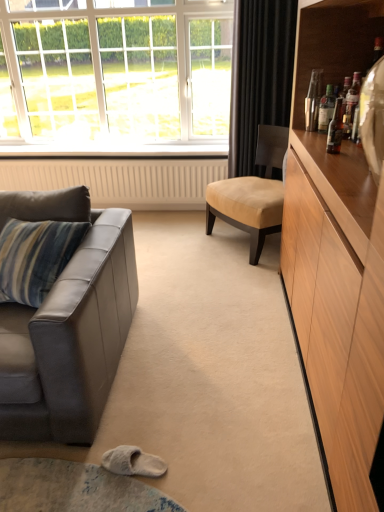
In order to face white glass window at upper left, should I rotate leftwards or rightwards?

Rotate left and turn 9.786 degrees.

I want to click on beige textured radiator at lower center, so click(120, 179).

Find the location of a particular element. The width and height of the screenshot is (384, 512). translucent glass bottle at upper right, acting as the 2th bottle starting from the front is located at coordinates (326, 109).

Describe the element at coordinates (67, 325) in the screenshot. I see `leather couch at left` at that location.

Describe the element at coordinates (259, 75) in the screenshot. I see `black velvet curtain at upper right` at that location.

Locate an element on the screen. The height and width of the screenshot is (512, 384). white glass window at upper left is located at coordinates (115, 73).

Between point (242, 32) and point (207, 226), which one is positioned in front?

Positioned in front is point (242, 32).

From a real-world perspective, is black velvet curtain at upper right positioned above or below beige leather chair at center?

black velvet curtain at upper right is situated higher than beige leather chair at center in the real world.

Considering the sizes of objects black velvet curtain at upper right and beige leather chair at center in the image provided, who is bigger, black velvet curtain at upper right or beige leather chair at center?

beige leather chair at center.

Considering the relative sizes of black velvet curtain at upper right and beige leather chair at center in the image provided, is black velvet curtain at upper right taller than beige leather chair at center?

Yes, black velvet curtain at upper right is taller than beige leather chair at center.

From a real-world perspective, which is physically above, beige leather chair at center or translucent glass bottle at upper right, arranged as the third bottle when viewed from the back?

From a 3D spatial view, translucent glass bottle at upper right, arranged as the third bottle when viewed from the back, is above.

Does beige leather chair at center have a lesser height compared to translucent glass bottle at upper right, arranged as the third bottle when viewed from the back?

Incorrect, the height of beige leather chair at center does not fall short of that of translucent glass bottle at upper right, arranged as the third bottle when viewed from the back.

Which is in front, beige leather chair at center or translucent glass bottle at upper right, marked as the first bottle in a front-to-back arrangement?

translucent glass bottle at upper right, marked as the first bottle in a front-to-back arrangement.

Between point (331, 108) and point (121, 323), which one is positioned behind?

The point (331, 108) is behind.

Is translucent glass bottle at upper right, acting as the 2th bottle starting from the front, located outside leather couch at left?

translucent glass bottle at upper right, acting as the 2th bottle starting from the front, is positioned outside leather couch at left.

Is translucent glass bottle at upper right, acting as the 2th bottle starting from the front, oriented away from leather couch at left?

No, translucent glass bottle at upper right, acting as the 2th bottle starting from the front, is not facing the opposite direction of leather couch at left.

Looking at their sizes, would you say translucent glass bottle at upper right, acting as the 2th bottle starting from the front, is wider or thinner than beige textured radiator at lower center?

Clearly, translucent glass bottle at upper right, acting as the 2th bottle starting from the front, has less width compared to beige textured radiator at lower center.

In terms of size, does translucent glass bottle at upper right, acting as the 2th bottle starting from the front, appear bigger or smaller than beige textured radiator at lower center?

translucent glass bottle at upper right, acting as the 2th bottle starting from the front, is smaller than beige textured radiator at lower center.

Is translucent glass bottle at upper right, acting as the 2th bottle starting from the front, in front of or behind beige textured radiator at lower center in the image?

translucent glass bottle at upper right, acting as the 2th bottle starting from the front, is positioned closer to the viewer than beige textured radiator at lower center.

Is translucent glass bottle at upper right, which is the second bottle from back to front, not within beige textured radiator at lower center?

translucent glass bottle at upper right, which is the second bottle from back to front, lies outside beige textured radiator at lower center's area.

Does translucent glass bottle at upper right, arranged as the third bottle when viewed from the back, have a lesser width compared to leather couch at left?

Correct, the width of translucent glass bottle at upper right, arranged as the third bottle when viewed from the back, is less than that of leather couch at left.

Which of these two, translucent glass bottle at upper right, marked as the first bottle in a front-to-back arrangement, or leather couch at left, stands shorter?

translucent glass bottle at upper right, marked as the first bottle in a front-to-back arrangement.

Is translucent glass bottle at upper right, marked as the first bottle in a front-to-back arrangement, aimed at leather couch at left?

No, translucent glass bottle at upper right, marked as the first bottle in a front-to-back arrangement, is not turned towards leather couch at left.

Is translucent glass bottle at upper right, marked as the first bottle in a front-to-back arrangement, inside the boundaries of leather couch at left, or outside?

translucent glass bottle at upper right, marked as the first bottle in a front-to-back arrangement, is not inside leather couch at left, it's outside.

Can you tell me how much shiny metallic bottle at upper right, marked as the third bottle in a front-to-back arrangement, and white glass window at upper left differ in facing direction?

They differ by 86.7 degrees in their facing directions.

Considering the sizes of objects shiny metallic bottle at upper right, marked as the third bottle in a front-to-back arrangement, and white glass window at upper left in the image provided, who is wider, shiny metallic bottle at upper right, marked as the third bottle in a front-to-back arrangement, or white glass window at upper left?

Wider between the two is white glass window at upper left.

Considering the relative positions of shiny metallic bottle at upper right, marked as the third bottle in a front-to-back arrangement, and white glass window at upper left in the image provided, is shiny metallic bottle at upper right, marked as the third bottle in a front-to-back arrangement, to the left of white glass window at upper left from the viewer's perspective?

Incorrect, shiny metallic bottle at upper right, marked as the third bottle in a front-to-back arrangement, is not on the left side of white glass window at upper left.

Is the depth of shiny metallic bottle at upper right, which is the first bottle in back-to-front order, less than that of white glass window at upper left?

That is True.

Is white glass window at upper left facing towards black velvet curtain at upper right?

Yes, white glass window at upper left is aimed at black velvet curtain at upper right.

From the image's perspective, which one is positioned lower, white glass window at upper left or black velvet curtain at upper right?

black velvet curtain at upper right, from the image's perspective.

From a real-world perspective, is white glass window at upper left beneath black velvet curtain at upper right?

No, from a real-world perspective, white glass window at upper left is not below black velvet curtain at upper right.

Is point (14, 57) positioned before point (268, 24)?

No.

This screenshot has height=512, width=384. Identify the location of chair on the left of black velvet curtain at upper right. (252, 194).

This screenshot has height=512, width=384. What are the coordinates of `bottle that is the 1st one when counting upward from the beige leather chair at center (from the image's perspective)` in the screenshot? It's located at (335, 128).

Estimate the real-world distances between objects in this image. Which object is closer to shiny metallic bottle at upper right, marked as the third bottle in a front-to-back arrangement, beige textured radiator at lower center or leather couch at left?

leather couch at left lies closer to shiny metallic bottle at upper right, marked as the third bottle in a front-to-back arrangement, than the other object.

Considering their positions, is translucent glass bottle at upper right, marked as the first bottle in a front-to-back arrangement, positioned closer to beige leather chair at center than leather couch at left?

The object closer to beige leather chair at center is translucent glass bottle at upper right, marked as the first bottle in a front-to-back arrangement.

When comparing their distances from black velvet curtain at upper right, does beige leather chair at center or beige textured radiator at lower center seem further?

Among the two, beige textured radiator at lower center is located further to black velvet curtain at upper right.

Based on their spatial positions, is beige leather chair at center or translucent glass bottle at upper right, acting as the 2th bottle starting from the front, further from leather couch at left?

Based on the image, translucent glass bottle at upper right, acting as the 2th bottle starting from the front, appears to be further to leather couch at left.

Looking at the image, which one is located closer to beige leather chair at center, leather couch at left or translucent glass bottle at upper right, marked as the first bottle in a front-to-back arrangement?

Among the two, translucent glass bottle at upper right, marked as the first bottle in a front-to-back arrangement, is located nearer to beige leather chair at center.

Based on their spatial positions, is beige textured radiator at lower center or white glass window at upper left closer to translucent glass bottle at upper right, marked as the first bottle in a front-to-back arrangement?

The object closer to translucent glass bottle at upper right, marked as the first bottle in a front-to-back arrangement, is beige textured radiator at lower center.

Estimate the real-world distances between objects in this image. Which object is further from leather couch at left, beige textured radiator at lower center or beige leather chair at center?

beige textured radiator at lower center is positioned further to the anchor leather couch at left.

Based on their spatial positions, is white glass window at upper left or beige textured radiator at lower center closer to leather couch at left?

beige textured radiator at lower center lies closer to leather couch at left than the other object.

This screenshot has width=384, height=512. I want to click on bottle between translucent glass bottle at upper right, which is the second bottle from back to front, and beige leather chair at center from front to back, so click(313, 100).

The image size is (384, 512). Identify the location of curtain located between leather couch at left and white glass window at upper left in the depth direction. (259, 75).

Locate an element on the screen. chair located between translucent glass bottle at upper right, acting as the 2th bottle starting from the front, and beige textured radiator at lower center in the depth direction is located at coordinates (252, 194).

Locate an element on the screen. The width and height of the screenshot is (384, 512). chair between leather couch at left and translucent glass bottle at upper right, marked as the first bottle in a front-to-back arrangement, in the horizontal direction is located at coordinates (252, 194).